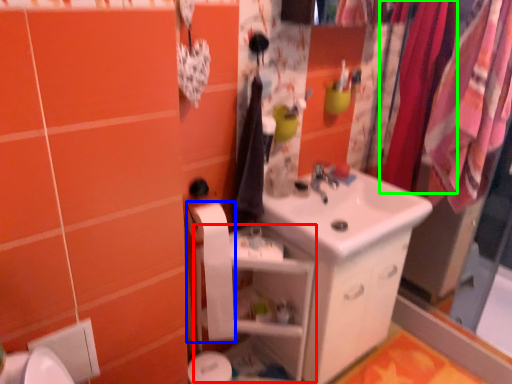
Question: Based on their relative distances, which object is farther from shelf (highlighted by a red box)? Choose from toilet paper (highlighted by a blue box) and clothesline (highlighted by a green box).

Choices:
 (A) toilet paper
 (B) clothesline

Answer: (B)